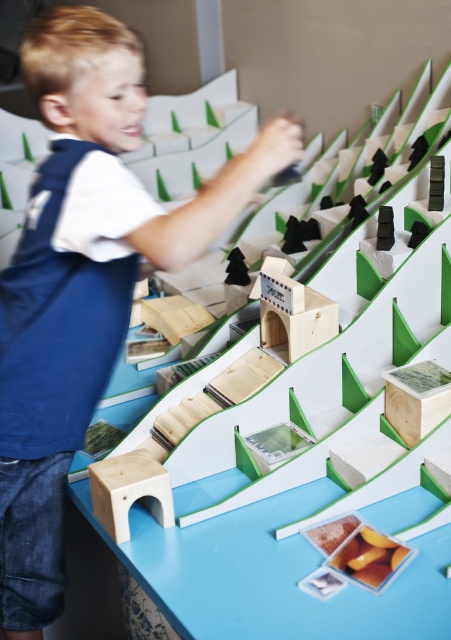
Does blue wood table at center appear under blue denim jeans at lower left?

Incorrect, blue wood table at center is not positioned below blue denim jeans at lower left.

Between point (252, 532) and point (33, 81), which one is positioned behind?

The point (252, 532) is behind.

This screenshot has width=451, height=640. Describe the element at coordinates (303, 456) in the screenshot. I see `blue wood table at center` at that location.

Find the location of `blue wood table at center`. blue wood table at center is located at coordinates (303, 456).